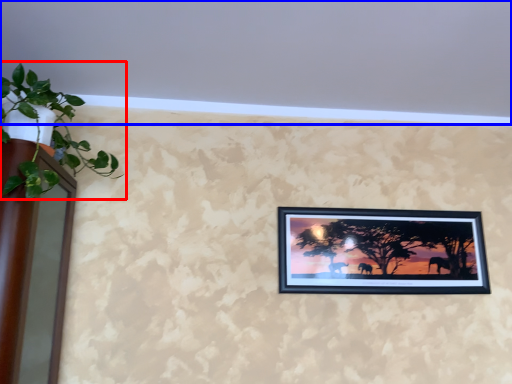
Question: Among these objects, which one is farthest to the camera, houseplant (highlighted by a red box) or backdrop (highlighted by a blue box)?

Choices:
 (A) houseplant
 (B) backdrop

Answer: (A)